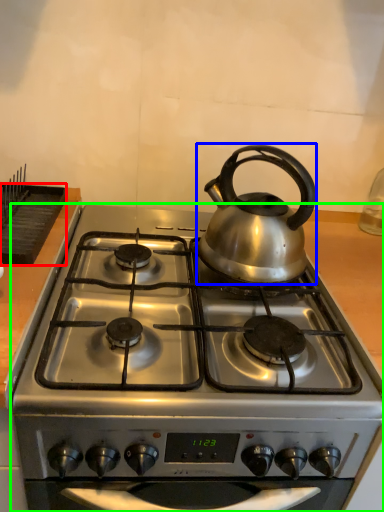
Question: Estimate the real-world distances between objects in this image. Which object is closer to kitchen appliance (highlighted by a red box), kettle (highlighted by a blue box) or gas stove (highlighted by a green box)?

Choices:
 (A) kettle
 (B) gas stove

Answer: (B)